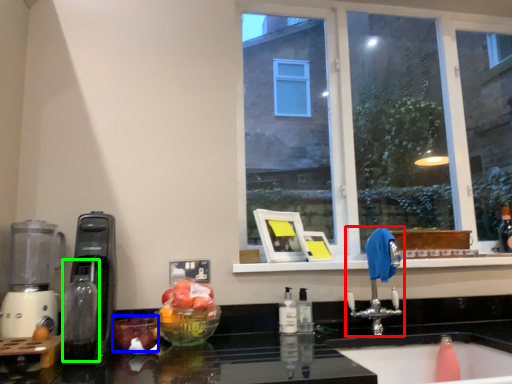
Question: Which is farther away from tap (highlighted by a red box)? apple (highlighted by a blue box) or bottle (highlighted by a green box)?

Choices:
 (A) apple
 (B) bottle

Answer: (B)